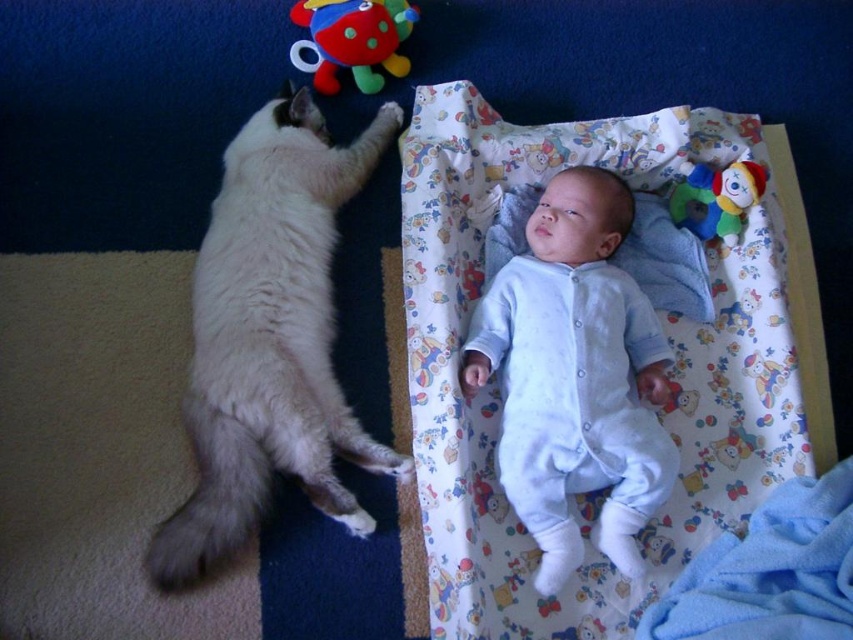
Based on the photo, who is more forward, (x=276, y=212) or (x=482, y=372)?

Positioned in front is point (x=482, y=372).

Does white fur cat at left have a lesser width compared to light blue cotton onesie at center?

No, white fur cat at left is not thinner than light blue cotton onesie at center.

Where is `white fur cat at left`? The height and width of the screenshot is (640, 853). white fur cat at left is located at coordinates (270, 337).

Consider the image. Does light blue cotton onesie at center have a smaller size compared to soft plush toy at upper center?

No, light blue cotton onesie at center is not smaller than soft plush toy at upper center.

Looking at this image, does light blue cotton onesie at center have a lesser height compared to soft plush toy at upper center?

Incorrect, light blue cotton onesie at center's height does not fall short of soft plush toy at upper center's.

Who is more forward, (x=627, y=336) or (x=305, y=40)?

Positioned in front is point (x=627, y=336).

At what (x,y) coordinates should I click in order to perform the action: click on light blue cotton onesie at center. Please return your answer as a coordinate pair (x, y). The height and width of the screenshot is (640, 853). Looking at the image, I should click on (575, 376).

Can you confirm if fluffy white blanket at upper right is positioned to the left of light blue cotton onesie at center?

No, fluffy white blanket at upper right is not to the left of light blue cotton onesie at center.

Which is below, fluffy white blanket at upper right or light blue cotton onesie at center?

light blue cotton onesie at center is below.

The height and width of the screenshot is (640, 853). I want to click on fluffy white blanket at upper right, so click(x=666, y=333).

The height and width of the screenshot is (640, 853). I want to click on fluffy white blanket at upper right, so click(666, 333).